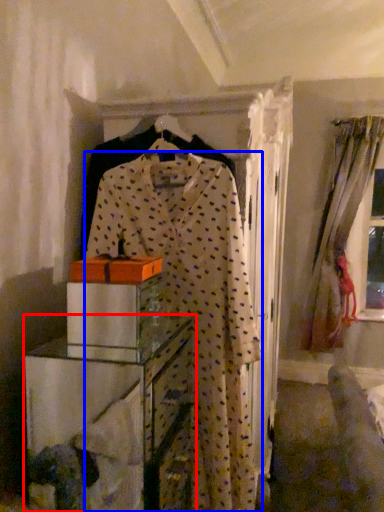
Question: Which point is closer to the camera, furniture (highlighted by a red box) or fancy dress (highlighted by a blue box)?

Choices:
 (A) furniture
 (B) fancy dress

Answer: (A)